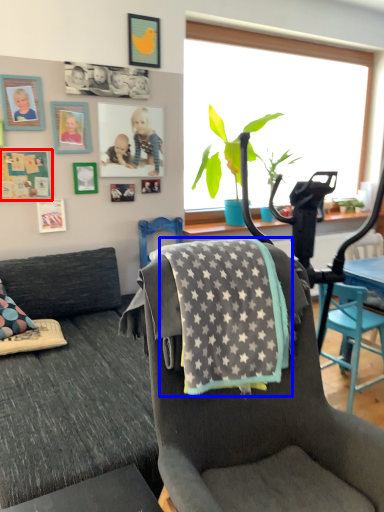
Question: Among these objects, which one is farthest to the camera, picture frame (highlighted by a red box) or blanket (highlighted by a blue box)?

Choices:
 (A) picture frame
 (B) blanket

Answer: (A)